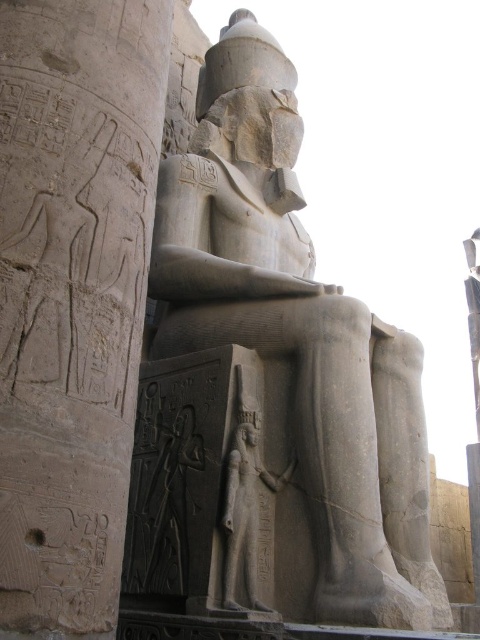
You are an archaeologist examining the ancient Egyptian statue and the hieroglyphic wall. You notice two points marked in the scene. Which of the two points, point (29, 12) or point (268, 234), is closer to your current position as you stand observing the statue?

Point (29, 12) is closer to the camera than point (268, 234), so the point (29, 12) is closer to your current position.

You are an archaeologist examining the ancient Egyptian site. You need to determine which object is taller between the gray stone hieroglyphics at center and the gray stone statue at center. Which one is taller?

The gray stone hieroglyphics at center has a lesser height compared to the gray stone statue at center, so the gray stone statue at center is taller.

You are an archaeologist examining the ancient Egyptian site. You need to determine which object is wider between the gray stone hieroglyphics at center and the gray stone statue at center. Which one is wider?

The gray stone hieroglyphics at center is less wide than the gray stone statue at center, so the gray stone statue at center is wider.